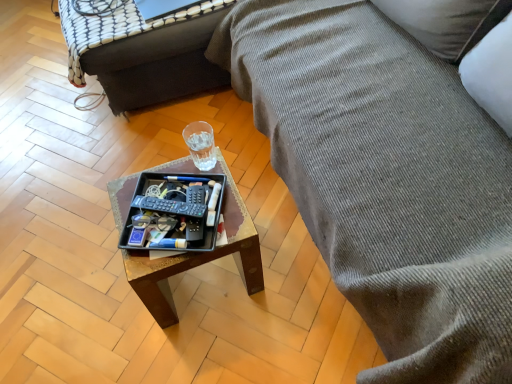
Find the location of `free space in front of wooden tray at center`. free space in front of wooden tray at center is located at coordinates (209, 348).